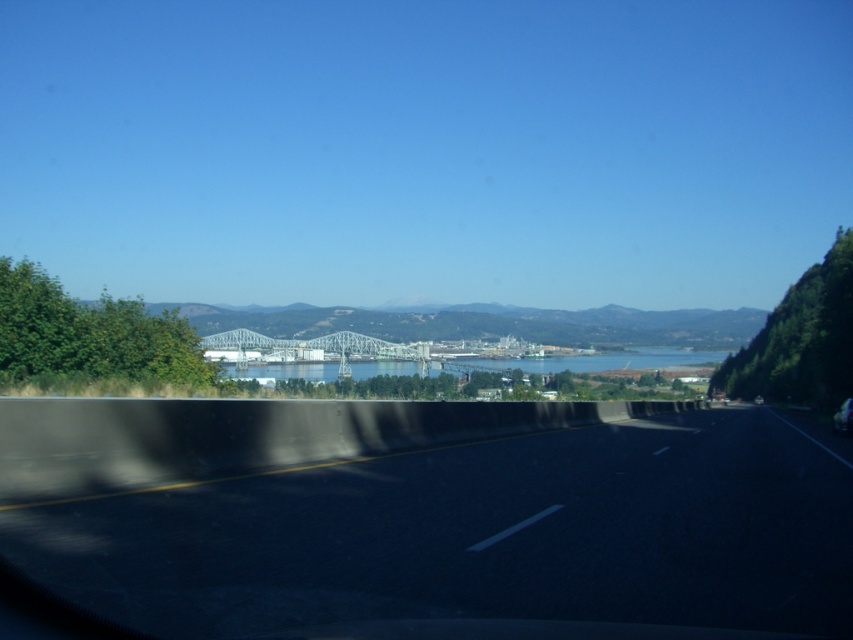
Question: Which of these objects is positioned farthest from the black asphalt highway at center?

Choices:
 (A) metallic silver car at center
 (B) blue water at center

Answer: (B)

Question: Which of these objects is positioned closest to the black asphalt highway at center?

Choices:
 (A) metallic silver car at center
 (B) blue water at center

Answer: (A)

Question: In this image, where is black asphalt highway at center located relative to metallic silver car at center?

Choices:
 (A) left
 (B) right

Answer: (A)

Question: Which of the following is the closest to the observer?

Choices:
 (A) metallic silver car at center
 (B) blue water at center
 (C) black asphalt highway at center

Answer: (C)

Question: Can you confirm if blue water at center is positioned to the left of metallic silver car at center?

Choices:
 (A) yes
 (B) no

Answer: (A)

Question: Is black asphalt highway at center closer to the viewer compared to metallic silver car at center?

Choices:
 (A) yes
 (B) no

Answer: (A)